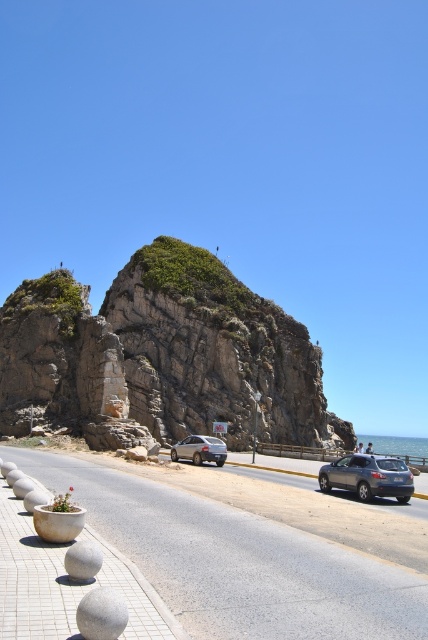
Which of these two, satin silver suv at center or white smooth sphere at lower left, stands taller?

Standing taller between the two is satin silver suv at center.

Is satin silver suv at center smaller than white smooth sphere at lower left?

No.

Is point (342, 472) behind point (80, 556)?

That is True.

Locate an element on the screen. The width and height of the screenshot is (428, 640). satin silver suv at center is located at coordinates (368, 476).

Is rocky cliff at upper center above gray asphalt highway at center?

Correct, rocky cliff at upper center is located above gray asphalt highway at center.

Between rocky cliff at upper center and gray asphalt highway at center, which one appears on the right side from the viewer's perspective?

gray asphalt highway at center is more to the right.

Describe the element at coordinates (162, 355) in the screenshot. I see `rocky cliff at upper center` at that location.

At what (x,y) coordinates should I click in order to perform the action: click on rocky cliff at upper center. Please return your answer as a coordinate pair (x, y). Image resolution: width=428 pixels, height=640 pixels. Looking at the image, I should click on coord(162,355).

Identify the location of satin silver suv at center. (368, 476).

Does point (395, 474) come in front of point (107, 624)?

No, it is not.

Where is `satin silver suv at center`? The image size is (428, 640). satin silver suv at center is located at coordinates (368, 476).